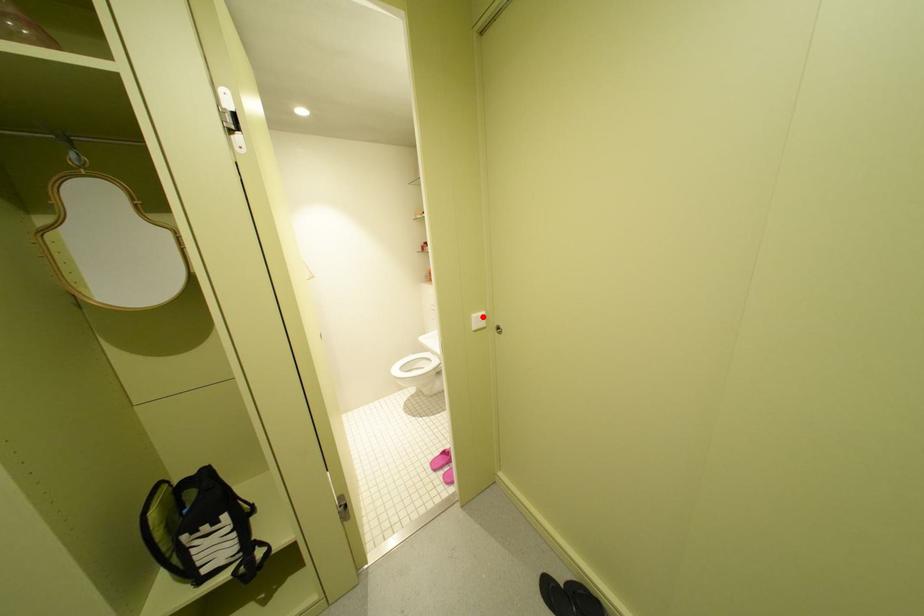
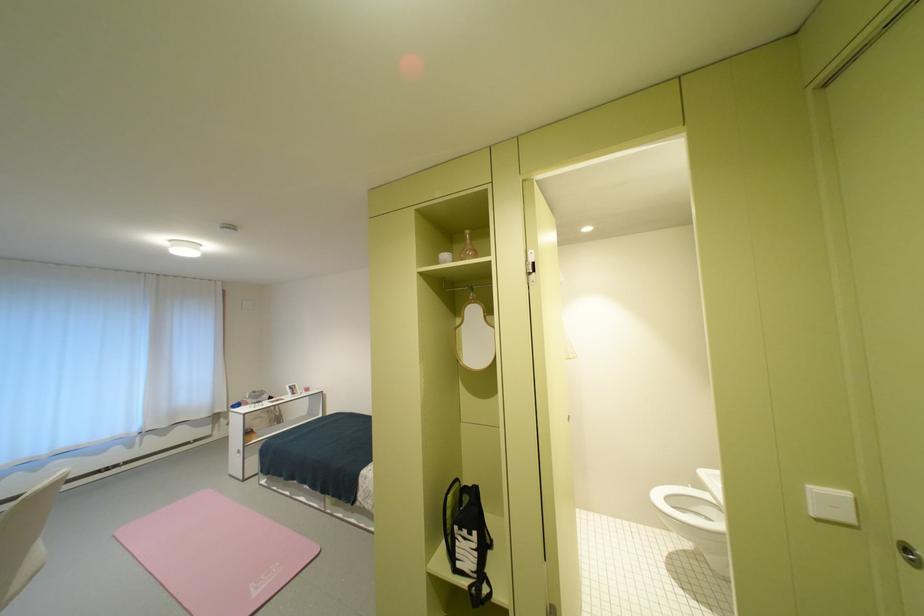
Find the pixel in the second image that matches the highlighted location in the first image.

(821, 488)